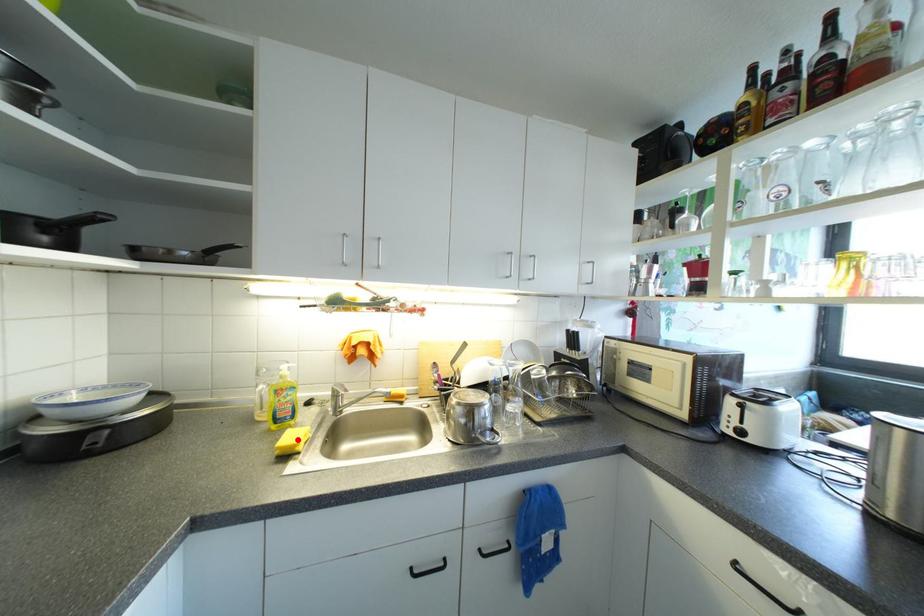
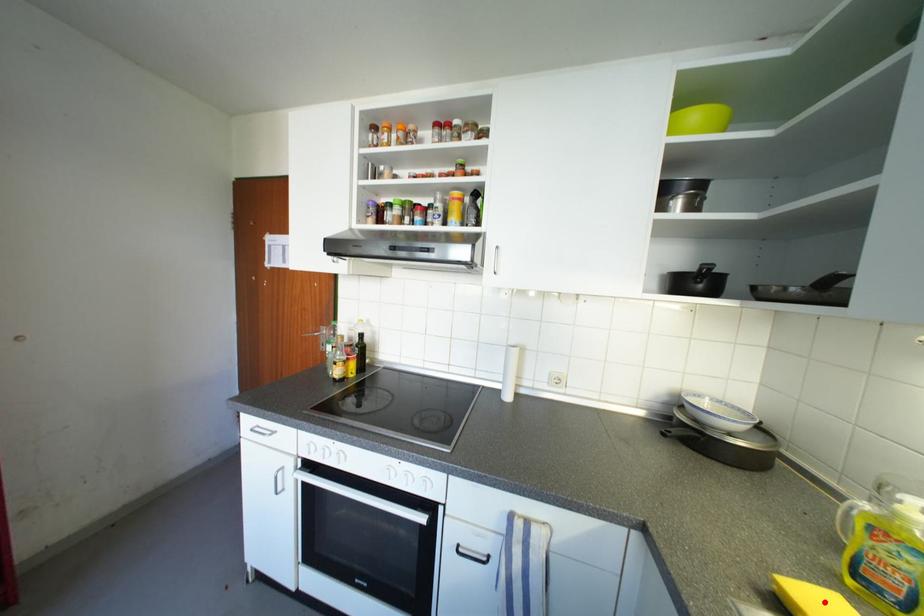
I am providing you with two images of the same scene from different viewpoints. A red point is marked on the first image and another point is marked on the second image. Do the highlighted points in image1 and image2 indicate the same real-world spot?

Yes